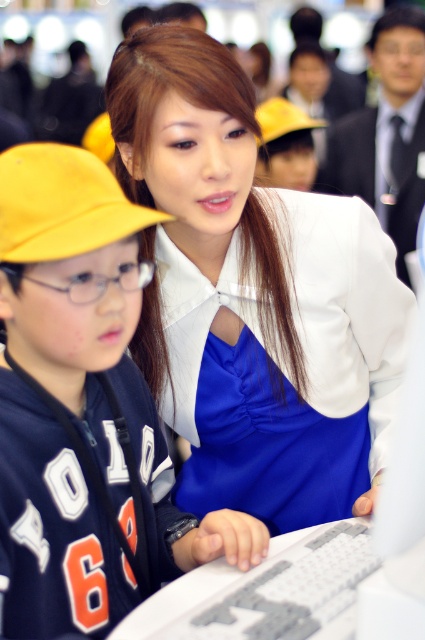
Is satin blue dress at center to the left of matte yellow cap at left from the viewer's perspective?

In fact, satin blue dress at center is to the right of matte yellow cap at left.

Is satin blue dress at center taller than matte yellow cap at left?

Yes, satin blue dress at center is taller than matte yellow cap at left.

Locate an element on the screen. satin blue dress at center is located at coordinates (249, 292).

Between point (243, 397) and point (36, 256), which one is positioned in front?

Point (36, 256) is more forward.

Is satin blue dress at center bigger than yellow fabric baseball hat at left?

Yes, satin blue dress at center is bigger than yellow fabric baseball hat at left.

Between point (220, 237) and point (146, 224), which one is positioned behind?

Positioned behind is point (220, 237).

Identify the location of satin blue dress at center. This screenshot has width=425, height=640. (249, 292).

Does matte yellow cap at left appear over yellow fabric baseball hat at left?

Incorrect, matte yellow cap at left is not positioned above yellow fabric baseball hat at left.

Between matte yellow cap at left and yellow fabric baseball hat at left, which one appears on the left side from the viewer's perspective?

yellow fabric baseball hat at left

Describe the element at coordinates (82, 410) in the screenshot. Image resolution: width=425 pixels, height=640 pixels. I see `matte yellow cap at left` at that location.

Identify the location of matte yellow cap at left. This screenshot has width=425, height=640. (82, 410).